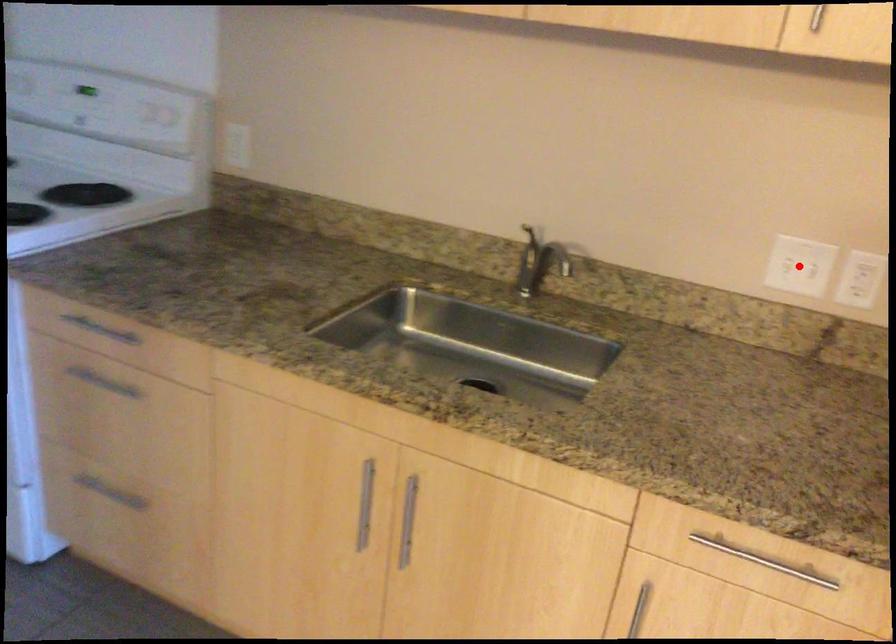
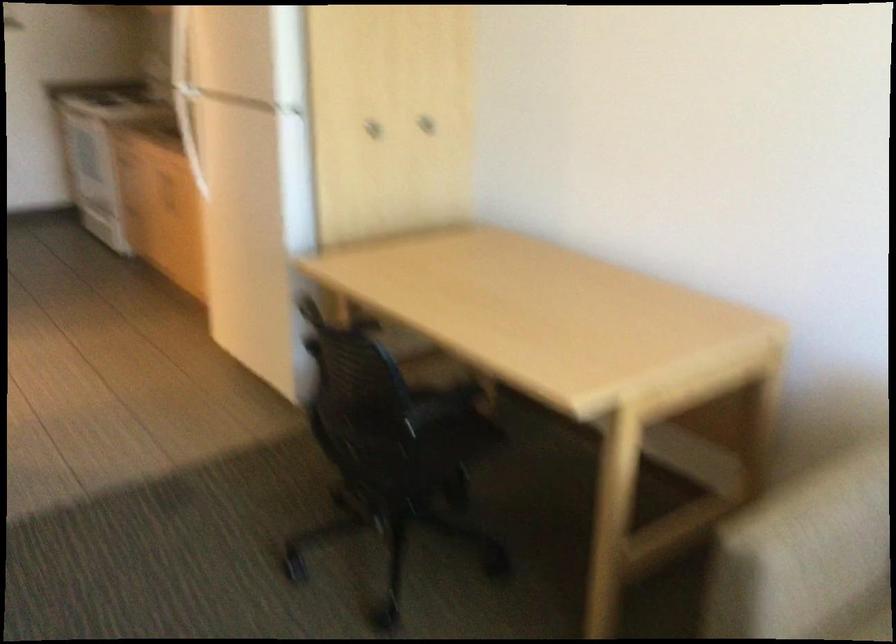
Question: I am providing you with two images of the same scene from different viewpoints. A red point is marked on the first image. At the location where the point appears in image 1, is it still visible in image 2?

Choices:
 (A) Yes
 (B) No

Answer: (B)